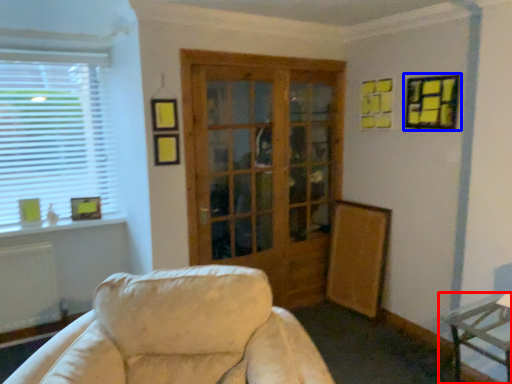
Question: Which of the following is the closest to the observer, table (highlighted by a red box) or picture frame (highlighted by a blue box)?

Choices:
 (A) table
 (B) picture frame

Answer: (A)